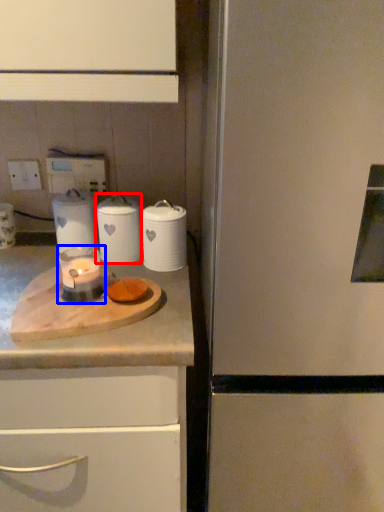
Question: Which of the following is the closest to the observer, kitchen appliance (highlighted by a red box) or candle holder (highlighted by a blue box)?

Choices:
 (A) kitchen appliance
 (B) candle holder

Answer: (B)